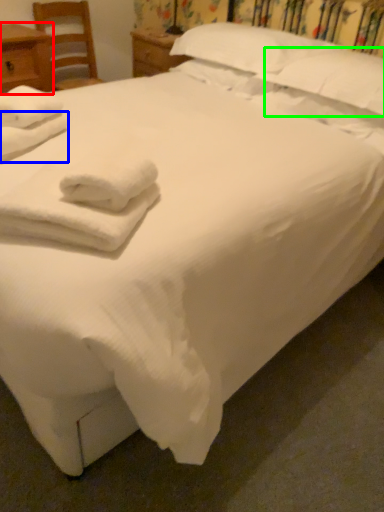
Question: Based on their relative distances, which object is nearer to nightstand (highlighted by a red box)? Choose from bath towel (highlighted by a blue box) and pillow (highlighted by a green box).

Choices:
 (A) bath towel
 (B) pillow

Answer: (A)